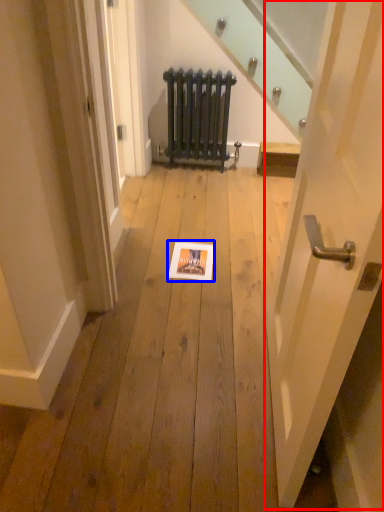
Question: Which point is further to the camera, door (highlighted by a red box) or picture frame (highlighted by a blue box)?

Choices:
 (A) door
 (B) picture frame

Answer: (B)